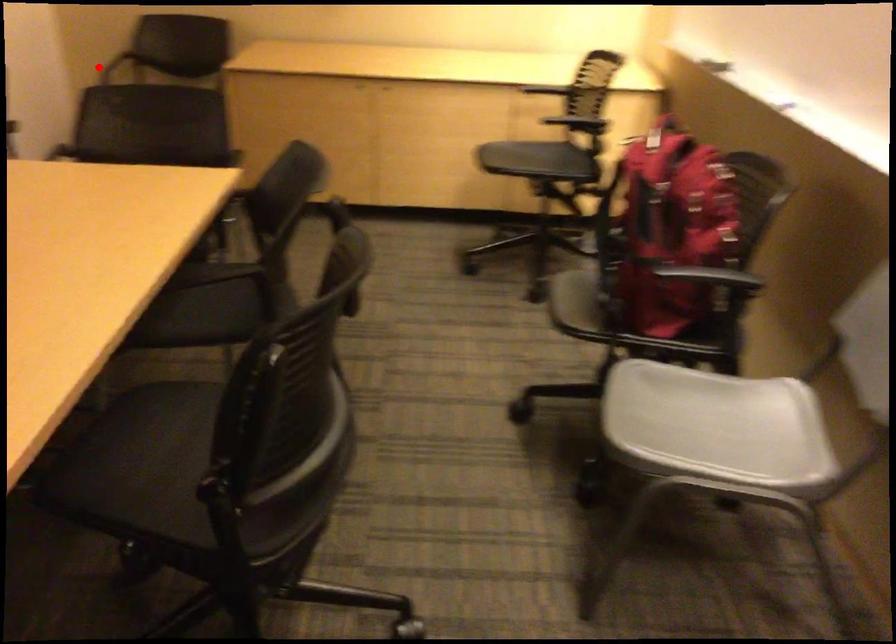
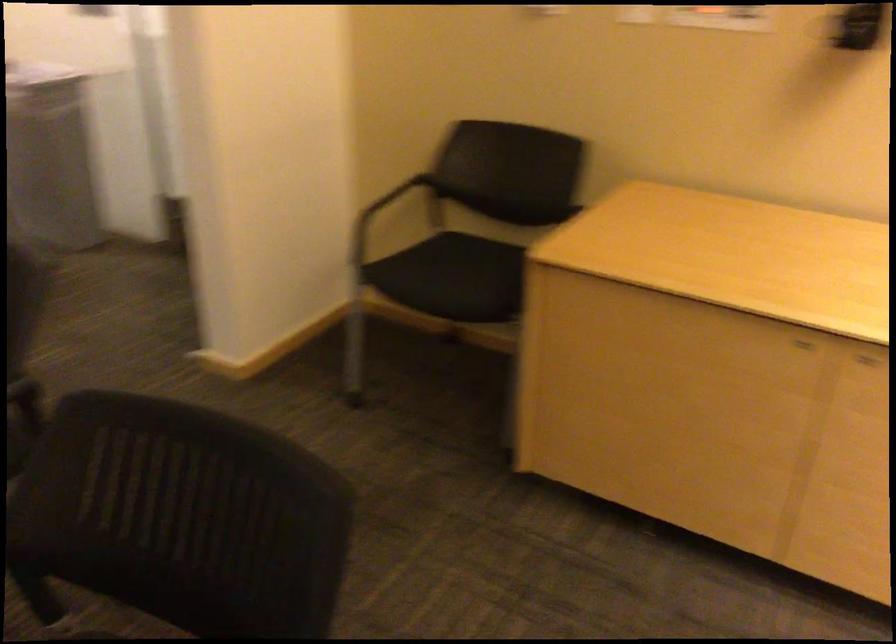
Locate, in the second image, the point that corresponds to the highlighted location in the first image.

(412, 196)